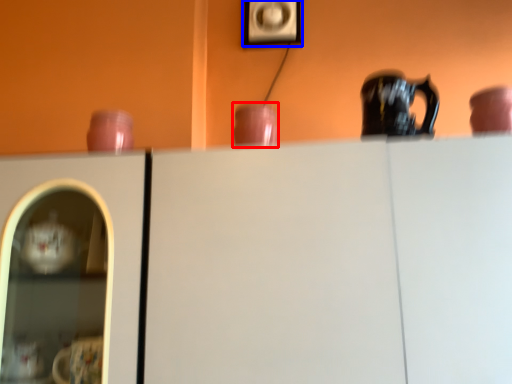
Question: Which object appears farthest to the camera in this image, tableware (highlighted by a red box) or picture frame (highlighted by a blue box)?

Choices:
 (A) tableware
 (B) picture frame

Answer: (B)